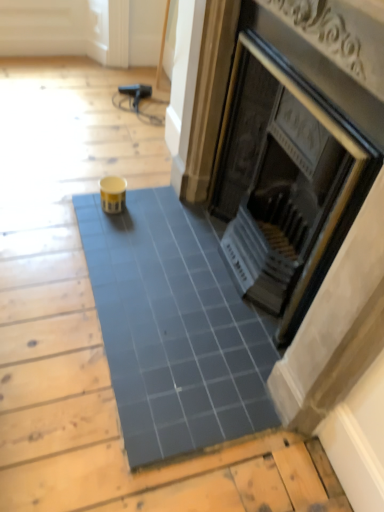
Question: Considering the positions of blue glossy tile at center and matte black fireplace at center in the image, is blue glossy tile at center taller or shorter than matte black fireplace at center?

Choices:
 (A) short
 (B) tall

Answer: (A)

Question: Is blue glossy tile at center in front of or behind matte black fireplace at center in the image?

Choices:
 (A) behind
 (B) front

Answer: (A)

Question: Would you say blue glossy tile at center is to the left or to the right of matte black fireplace at center in the picture?

Choices:
 (A) right
 (B) left

Answer: (B)

Question: Looking at their shapes, would you say matte black fireplace at center is wider or thinner than blue glossy tile at center?

Choices:
 (A) thin
 (B) wide

Answer: (A)

Question: Considering the positions of matte black fireplace at center and blue glossy tile at center in the image, is matte black fireplace at center taller or shorter than blue glossy tile at center?

Choices:
 (A) short
 (B) tall

Answer: (B)

Question: From a real-world perspective, is matte black fireplace at center physically located above or below blue glossy tile at center?

Choices:
 (A) below
 (B) above

Answer: (B)

Question: From the image's perspective, is matte black fireplace at center located above or below blue glossy tile at center?

Choices:
 (A) above
 (B) below

Answer: (A)